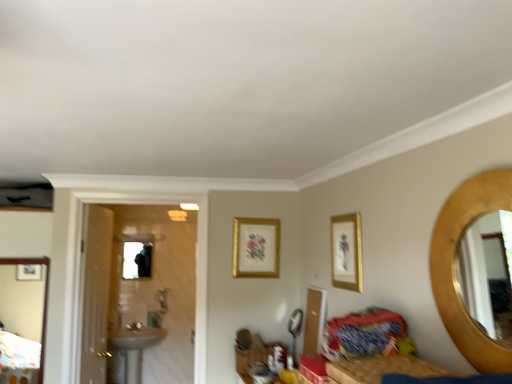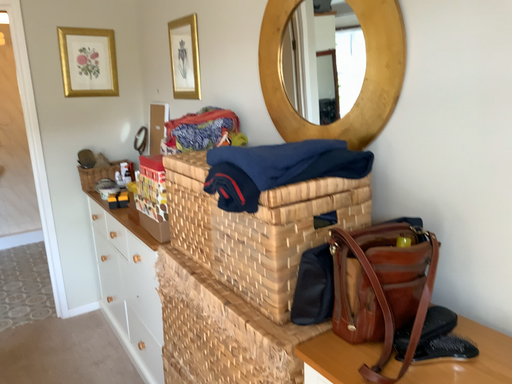
Question: How did the camera likely rotate when shooting the video?

Choices:
 (A) rotated left
 (B) rotated right

Answer: (B)